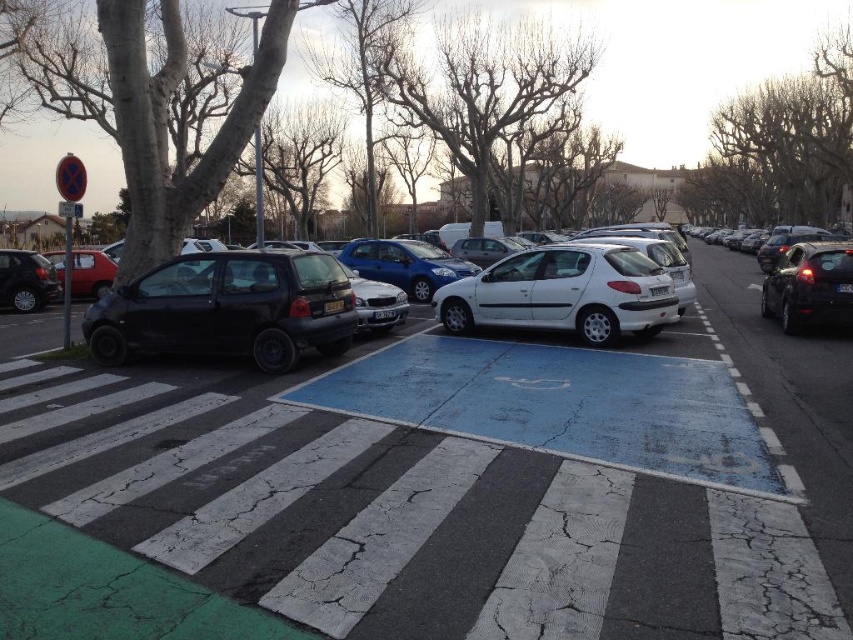
Question: Which point is closer to the camera?

Choices:
 (A) (422, 600)
 (B) (28, 288)
 (C) (566, 314)
 (D) (820, 284)

Answer: (A)

Question: Is matte black car at left below shiny black sedan at right?

Choices:
 (A) no
 (B) yes

Answer: (B)

Question: Which of the following is the closest to the observer?

Choices:
 (A) (299, 342)
 (B) (24, 262)
 (C) (799, 252)

Answer: (A)

Question: Does white matte car at center appear over white matte hatchback at center?

Choices:
 (A) no
 (B) yes

Answer: (A)

Question: Which point is closer to the camera?

Choices:
 (A) (67, 410)
 (B) (238, 280)
 (C) (0, 257)

Answer: (A)

Question: Is white matte hatchback at center bigger than shiny black car at left?

Choices:
 (A) no
 (B) yes

Answer: (B)